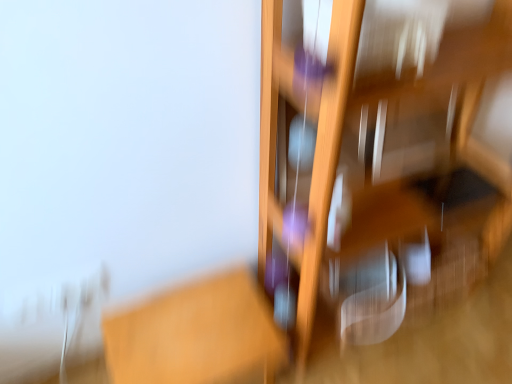
Question: Does wooden shelf at right turn towards wooden table at center?

Choices:
 (A) yes
 (B) no

Answer: (B)

Question: Is wooden shelf at right positioned in front of wooden table at center?

Choices:
 (A) yes
 (B) no

Answer: (A)

Question: Is wooden shelf at right positioned with its back to wooden table at center?

Choices:
 (A) no
 (B) yes

Answer: (A)

Question: Is wooden shelf at right placed right next to wooden table at center?

Choices:
 (A) no
 (B) yes

Answer: (A)

Question: Is wooden shelf at right further to the viewer compared to wooden table at center?

Choices:
 (A) no
 (B) yes

Answer: (A)

Question: From the image's perspective, is wooden shelf at right located beneath wooden table at center?

Choices:
 (A) yes
 (B) no

Answer: (B)

Question: Does wooden table at center have a greater width compared to wooden shelf at right?

Choices:
 (A) yes
 (B) no

Answer: (B)

Question: From a real-world perspective, is wooden table at center positioned over wooden shelf at right based on gravity?

Choices:
 (A) no
 (B) yes

Answer: (A)

Question: Does wooden table at center lie behind wooden shelf at right?

Choices:
 (A) no
 (B) yes

Answer: (B)

Question: Could wooden shelf at right be considered to be inside wooden table at center?

Choices:
 (A) no
 (B) yes

Answer: (A)

Question: From the image's perspective, is wooden table at center on top of wooden shelf at right?

Choices:
 (A) no
 (B) yes

Answer: (A)

Question: Is wooden shelf at right at the back of wooden table at center?

Choices:
 (A) yes
 (B) no

Answer: (B)

Question: Considering the positions of wooden shelf at right and wooden table at center in the image, is wooden shelf at right taller or shorter than wooden table at center?

Choices:
 (A) tall
 (B) short

Answer: (A)